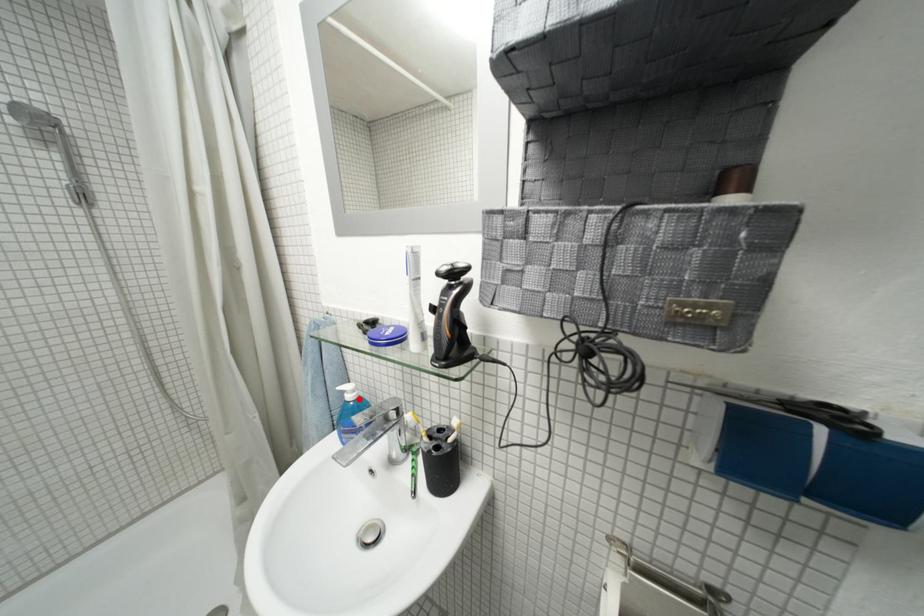
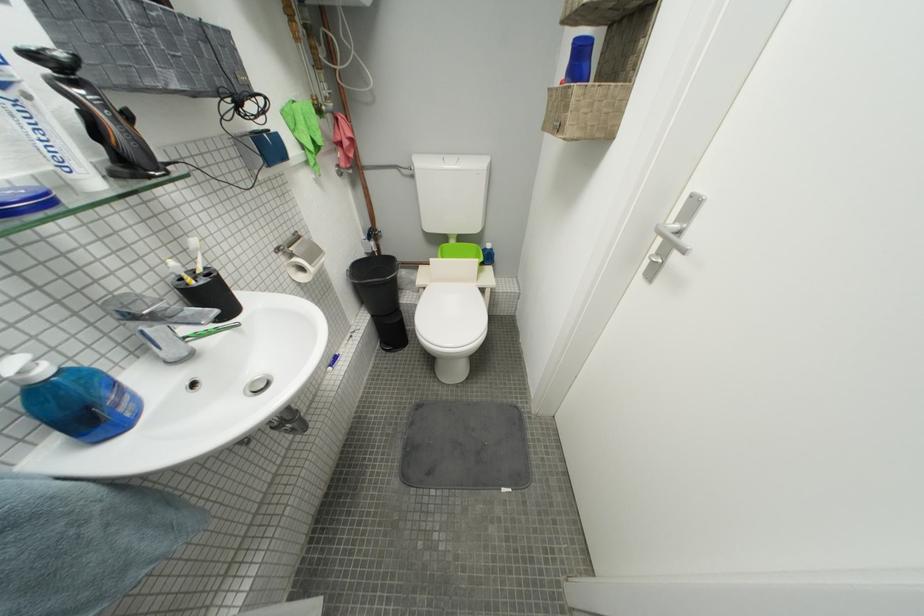
Locate, in the second image, the point that corresponds to the highlighted location in the first image.

(53, 374)